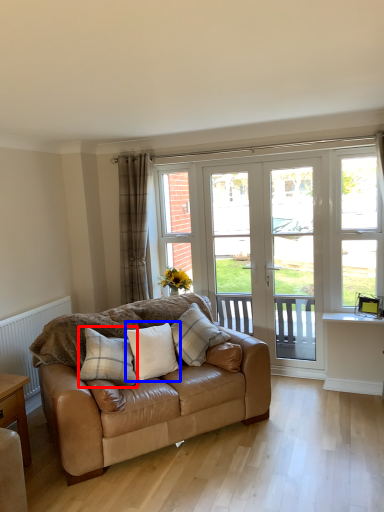
Question: Which object appears farthest to the camera in this image, pillow (highlighted by a red box) or pillow (highlighted by a blue box)?

Choices:
 (A) pillow
 (B) pillow

Answer: (B)